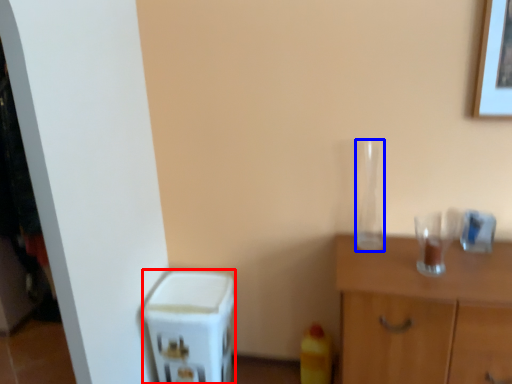
Question: Which of the following is the closest to the observer, appliance (highlighted by a red box) or glass vase (highlighted by a blue box)?

Choices:
 (A) appliance
 (B) glass vase

Answer: (B)